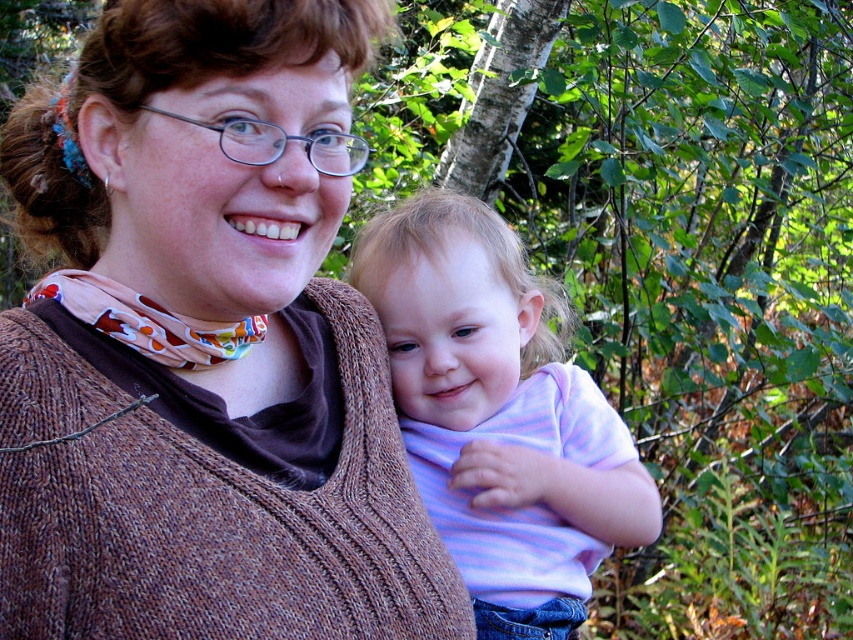
Question: Can you confirm if brown knitted sweater at center is bigger than pastel striped shirt at center?

Choices:
 (A) no
 (B) yes

Answer: (B)

Question: Which point is farther to the camera?

Choices:
 (A) [x=534, y=602]
 (B) [x=279, y=180]

Answer: (A)

Question: Among these objects, which one is nearest to the camera?

Choices:
 (A) pastel striped shirt at center
 (B) brown knitted sweater at center

Answer: (B)

Question: Is brown knitted sweater at center below pastel striped shirt at center?

Choices:
 (A) no
 (B) yes

Answer: (A)

Question: Does brown knitted sweater at center come behind pastel striped shirt at center?

Choices:
 (A) yes
 (B) no

Answer: (B)